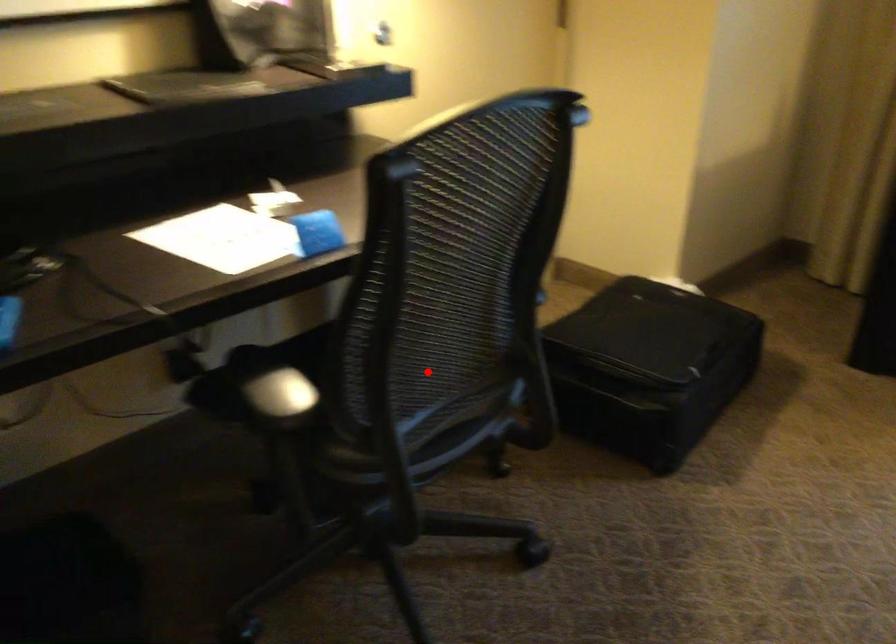
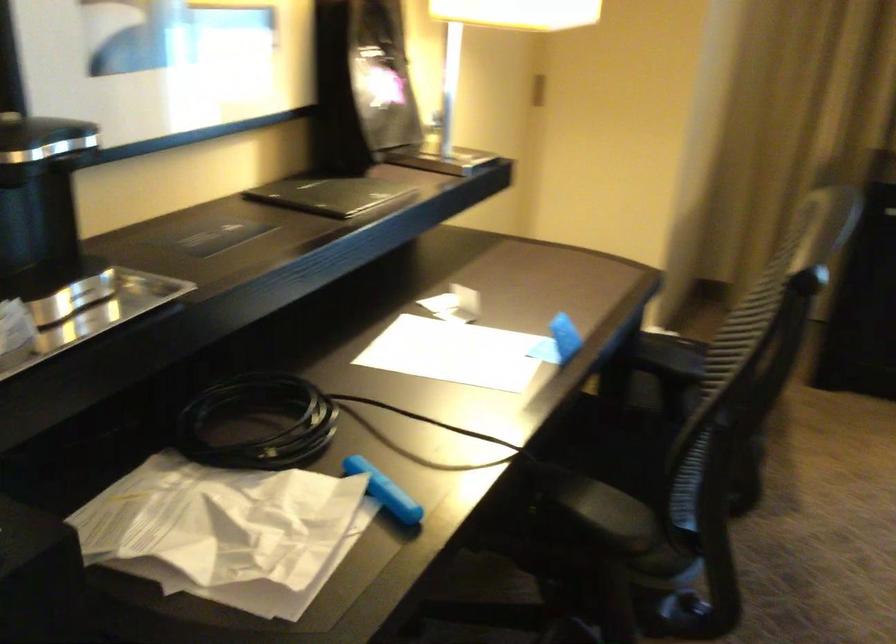
In the second image, find the point that corresponds to the highlighted location in the first image.

(625, 457)